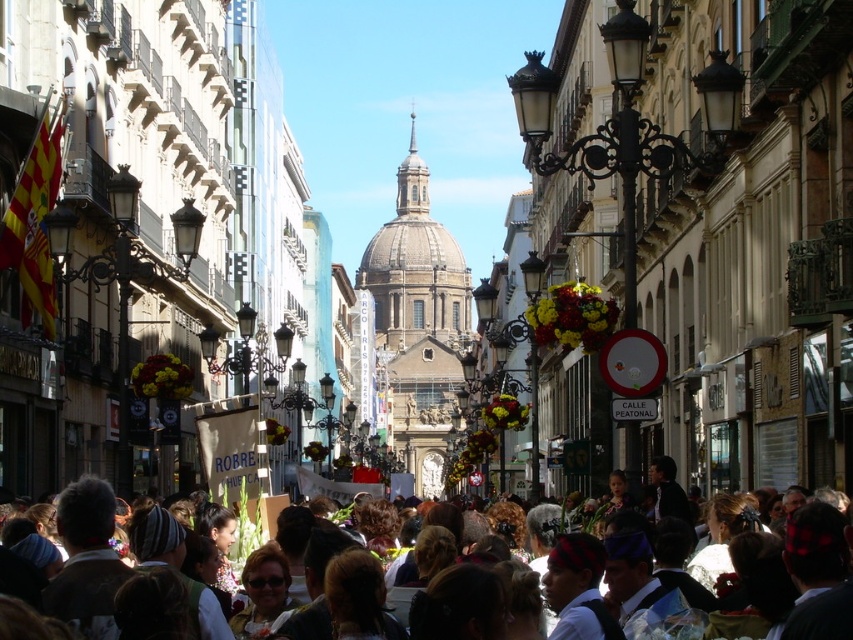
This screenshot has height=640, width=853. Describe the element at coordinates (418, 323) in the screenshot. I see `smooth stone dome at center` at that location.

Is smooth stone dome at center above brown hair at center?

Correct, smooth stone dome at center is located above brown hair at center.

Is point (387, 252) in front of point (19, 579)?

That is False.

Image resolution: width=853 pixels, height=640 pixels. I want to click on smooth stone dome at center, so click(x=418, y=323).